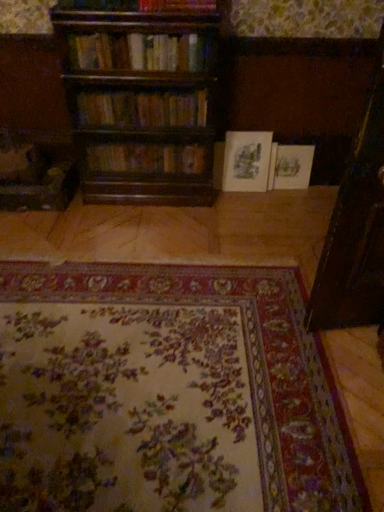
Find the location of a particular element. blank space to the left of white paper book at center, the 5th book in the front-to-back sequence is located at coordinates (277, 193).